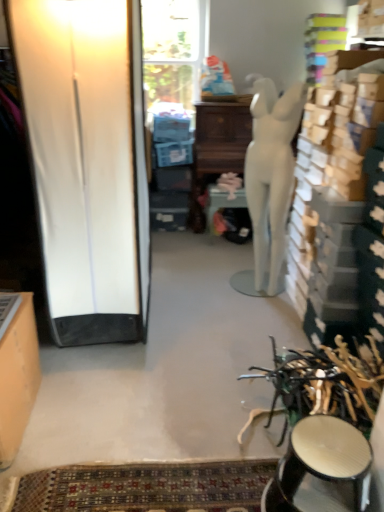
This screenshot has height=512, width=384. Find the location of `vacant space that is in between white matte mannequin at center and white glossy screen door at left`. vacant space that is in between white matte mannequin at center and white glossy screen door at left is located at coordinates (194, 305).